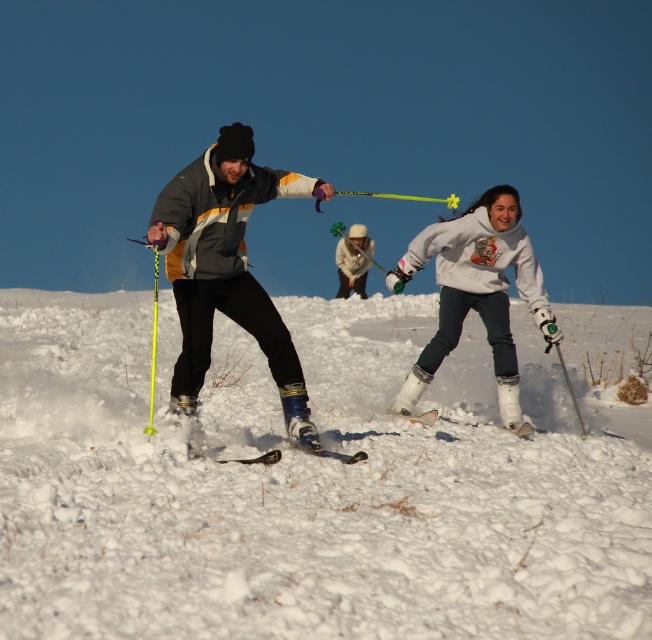
Which is below, matte gray jacket at center or white matte snowboarder at center?

matte gray jacket at center is lower down.

I want to click on matte gray jacket at center, so click(228, 268).

The height and width of the screenshot is (640, 652). What are the coordinates of `matte gray jacket at center` in the screenshot? It's located at (228, 268).

Is point (226, 148) closer to camera compared to point (331, 456)?

That is True.

Is point (244, 328) farther from viewer compared to point (265, 461)?

That is True.

Is point (323, 193) farther from camera compared to point (258, 460)?

Yes, point (323, 193) is behind point (258, 460).

What are the coordinates of `matte gray jacket at center` in the screenshot? It's located at (228, 268).

Find the location of `matte gray jacket at center`. matte gray jacket at center is located at coordinates (228, 268).

Is matte gray jacket at center positioned in front of white fleece jacket at center?

Yes, matte gray jacket at center is in front of white fleece jacket at center.

Where is `matte gray jacket at center`? matte gray jacket at center is located at coordinates (228, 268).

Where is `matte gray jacket at center`? Image resolution: width=652 pixels, height=640 pixels. matte gray jacket at center is located at coordinates 228,268.